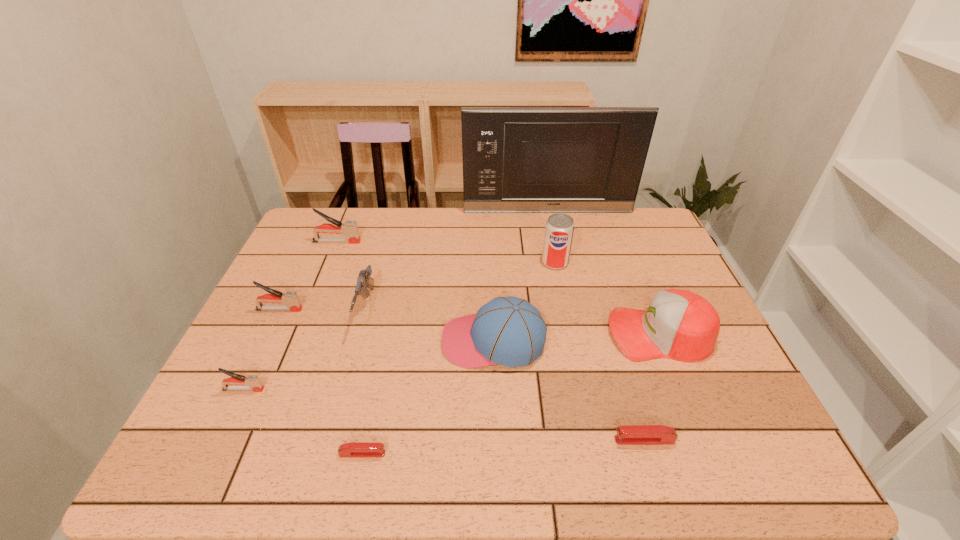
The width and height of the screenshot is (960, 540). What are the coordinates of `the second farthest gray stapler` in the screenshot? It's located at tap(290, 298).

At what (x,y) coordinates should I click in order to perform the action: click on the nearest gray stapler. Please return your answer as a coordinate pair (x, y). This screenshot has height=540, width=960. Looking at the image, I should click on (254, 384).

You are a GUI agent. You are given a task and a screenshot of the screen. Output one action in this format:
    pyautogui.click(x=<x>, y=<y>)
    Task: Click on the third farthest stapler
    
    Given the screenshot: What is the action you would take?
    pyautogui.click(x=254, y=384)

Locate an element on the screen. Image resolution: width=960 pixels, height=540 pixels. the ninth farthest object is located at coordinates [630, 434].

You are a GUI agent. You are given a task and a screenshot of the screen. Output one action in this format:
    pyautogui.click(x=<x>, y=<y>)
    Task: Click on the rightmost stapler
    The width and height of the screenshot is (960, 540).
    Given the screenshot: What is the action you would take?
    pyautogui.click(x=630, y=434)

You are a GUI agent. You are given a task and a screenshot of the screen. Output one action in this format:
    pyautogui.click(x=<x>, y=<y>)
    Task: Click on the left red stapler
    
    Given the screenshot: What is the action you would take?
    pyautogui.click(x=352, y=449)

The image size is (960, 540). Identify the location of the nearest stapler. (352, 449).

Locate an element on the screen. This screenshot has height=540, width=960. blank space located 0.270m on the front panel of the dark microwave oven is located at coordinates (559, 261).

I want to click on vacant space located on the back of the ninth shortest object, so click(x=551, y=241).

You are a GUI agent. You are given a task and a screenshot of the screen. Output one action in this format:
    pyautogui.click(x=<x>, y=<y>)
    Task: Click on the vacant region located on the handle side of the second farthest object
    This screenshot has height=540, width=960.
    Given the screenshot: What is the action you would take?
    pyautogui.click(x=469, y=242)